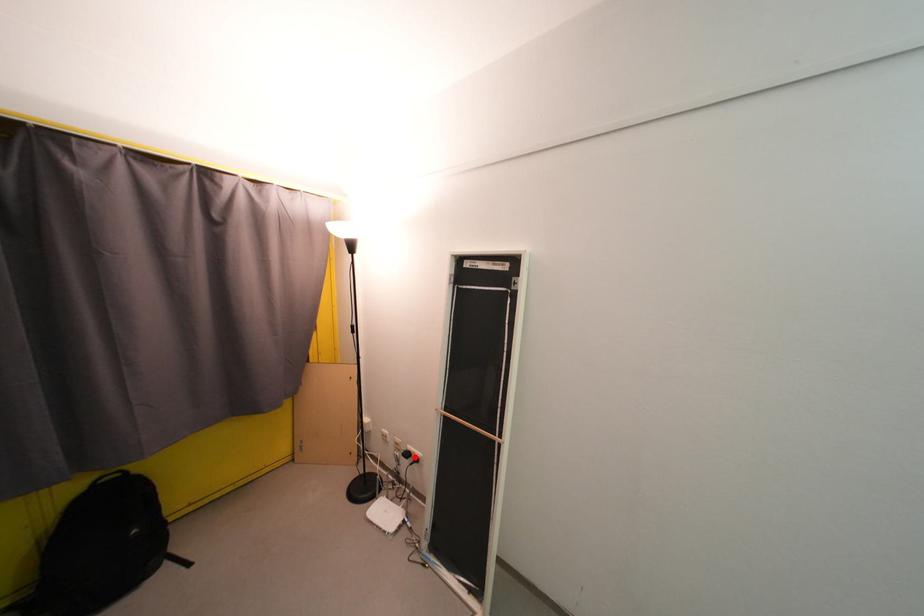
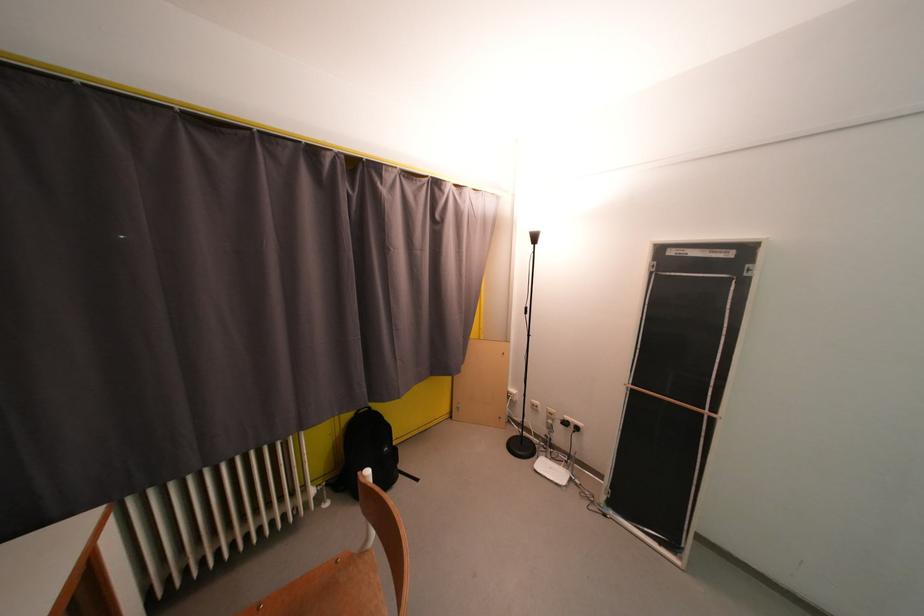
Question: I am providing you with two images of the same scene from different viewpoints. In image1, a red point is highlighted. Considering the same 3D point in image2, which of the following is correct?

Choices:
 (A) It is closer
 (B) It is farther

Answer: (A)